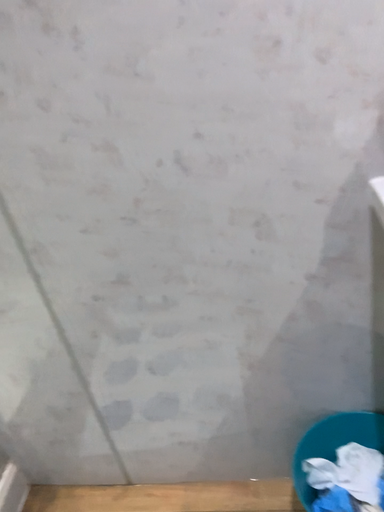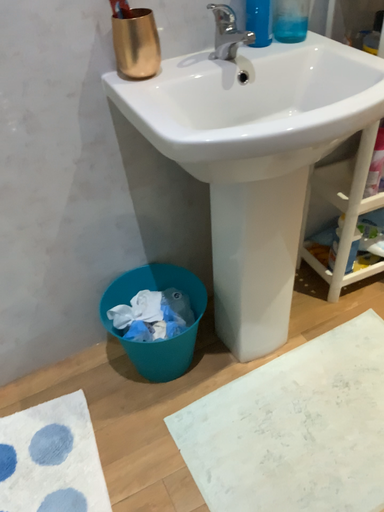
Question: Which way did the camera rotate in the video?

Choices:
 (A) rotated right
 (B) rotated left

Answer: (A)